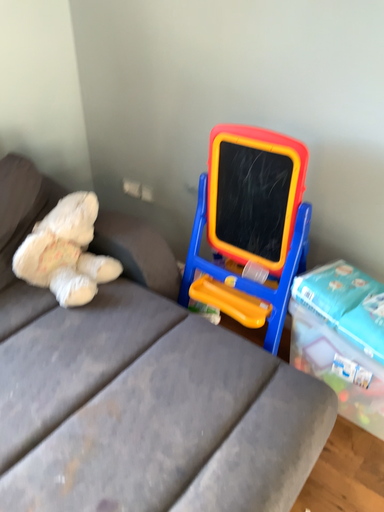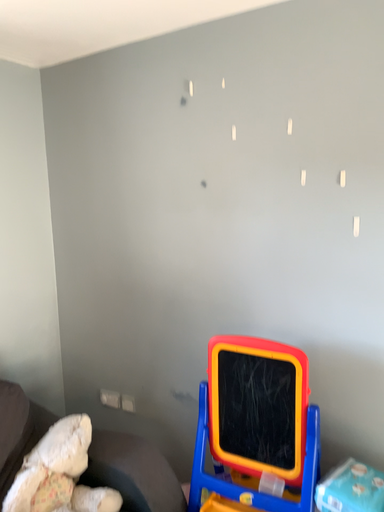
Question: Which way did the camera rotate in the video?

Choices:
 (A) rotated left
 (B) rotated right

Answer: (B)